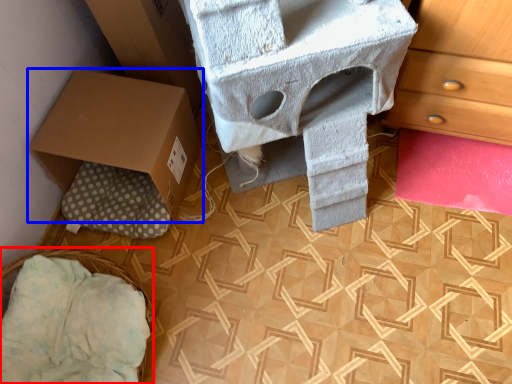
Question: Which object is further to the camera taking this photo, basket (highlighted by a red box) or box (highlighted by a blue box)?

Choices:
 (A) basket
 (B) box

Answer: (B)